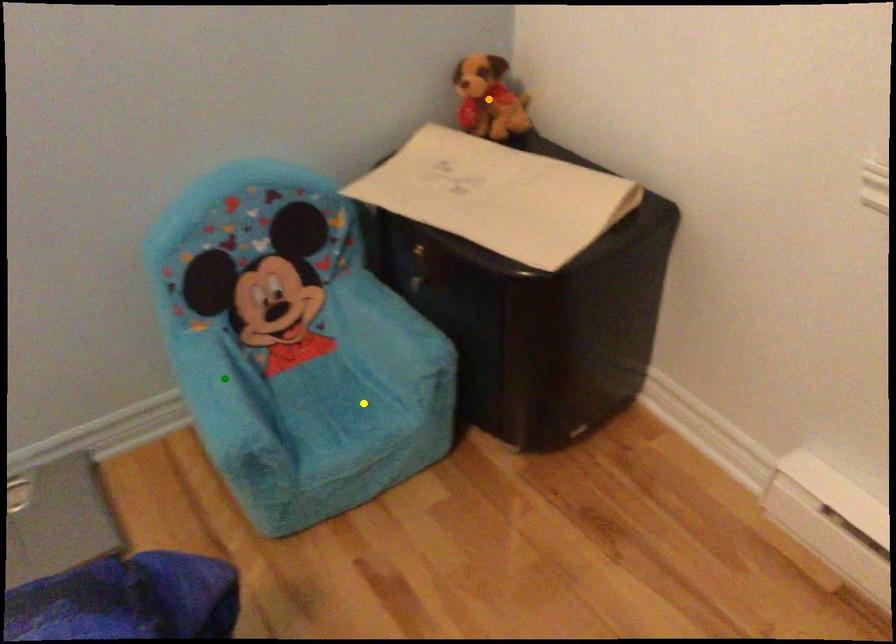
Order these from nearest to farthest:
yellow point | orange point | green point

green point → yellow point → orange point